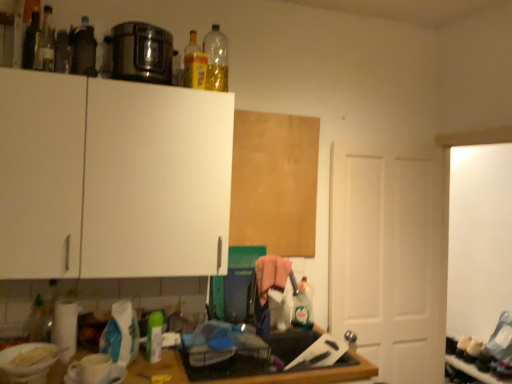
Question: From the image's perspective, is translucent yellow bottle at upper center, the 4th bottle when ordered from right to left, above or below translucent glass bottle at upper left, the second bottle positioned from the front?

Choices:
 (A) below
 (B) above

Answer: (A)

Question: Would you say translucent yellow bottle at upper center, placed as the 3th bottle when sorted from back to front, is to the left or to the right of translucent glass bottle at upper left, the sixth bottle from the bottom, in the picture?

Choices:
 (A) left
 (B) right

Answer: (B)

Question: Estimate the real-world distances between objects in this image. Which object is closer to the metallic silver pressure cooker at upper center?

Choices:
 (A) matte glass bottle at upper left, the second bottle when ordered from top to bottom
 (B) white matte cabinet at upper left, which appears as the second cabinetry when viewed from the back
 (C) white glossy coffee cup at lower left
 (D) matte black bottle at upper left, placed as the 6th bottle when sorted from back to front
 (E) white matte door at right

Answer: (D)

Question: Which object is the closest to the translucent yellow bottle at upper center, the fourth bottle ordered from the bottom?

Choices:
 (A) matte glass bottle at upper left, which is the first bottle in front-to-back order
 (B) translucent glass bottle at upper left, the 7th bottle from the right
 (C) translucent plastic bottle at lower right, the eighth bottle when ordered from top to bottom
 (D) wooden board at upper center, which is the 1th cabinetry in right-to-left order
 (E) metallic silver pressure cooker at upper center

Answer: (E)